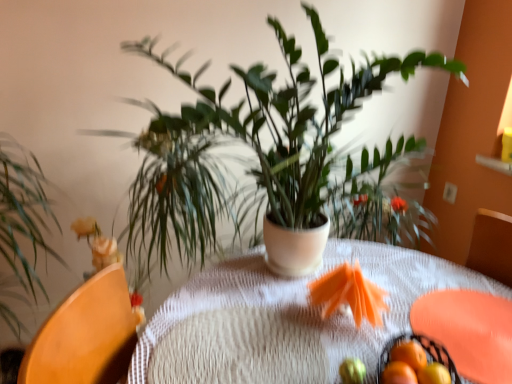
Measure the distance between point (438, 365) and camera.

A distance of 87.30 centimeters exists between point (438, 365) and camera.

Image resolution: width=512 pixels, height=384 pixels. What do you see at coordinates (434, 374) in the screenshot? I see `orange matte tangerine at lower right, the second tangerine in the front-to-back sequence` at bounding box center [434, 374].

Where is `orange matte tangerine at lower right, arranged as the third tangerine when viewed from the front`? orange matte tangerine at lower right, arranged as the third tangerine when viewed from the front is located at coordinates (409, 354).

Describe the element at coordinates (270, 159) in the screenshot. I see `green matte plant at center, which is the first houseplant in right-to-left order` at that location.

Locate an element on the screen. The height and width of the screenshot is (384, 512). orange matte tangerine at lower right, the second tangerine in the front-to-back sequence is located at coordinates (434, 374).

Is orange matte tangerine at lower right, positioned as the 1th tangerine in back-to-front order, far from orange matte tangerine at lower right, which is the 2th tangerine from back to front?

orange matte tangerine at lower right, positioned as the 1th tangerine in back-to-front order, is near orange matte tangerine at lower right, which is the 2th tangerine from back to front, not far away.

Is orange matte tangerine at lower right, positioned as the 1th tangerine in back-to-front order, at the right side of orange matte tangerine at lower right, the second tangerine in the front-to-back sequence?

In fact, orange matte tangerine at lower right, positioned as the 1th tangerine in back-to-front order, is to the left of orange matte tangerine at lower right, the second tangerine in the front-to-back sequence.

Can you tell me how much orange matte tangerine at lower right, positioned as the 1th tangerine in back-to-front order, and orange matte tangerine at lower right, which is the 2th tangerine from back to front, differ in facing direction?

The angular difference between orange matte tangerine at lower right, positioned as the 1th tangerine in back-to-front order, and orange matte tangerine at lower right, which is the 2th tangerine from back to front, is 0.000167 degrees.

Which is more to the right, orange matte tangerine at lower right, the third tangerine positioned from the back, or orange matte tangerine at lower right, the second tangerine in the front-to-back sequence?

orange matte tangerine at lower right, the second tangerine in the front-to-back sequence.

From a real-world perspective, is orange matte tangerine at lower right, the third tangerine positioned from the back, above or below orange matte tangerine at lower right, which is the 2th tangerine from back to front?

From a real-world perspective, orange matte tangerine at lower right, the third tangerine positioned from the back, is physically above orange matte tangerine at lower right, which is the 2th tangerine from back to front.

Consider the image. From the image's perspective, which one is positioned higher, orange matte tangerine at lower right, the third tangerine positioned from the back, or orange matte tangerine at lower right, which is the 2th tangerine from back to front?

orange matte tangerine at lower right, the third tangerine positioned from the back.

From their relative heights in the image, would you say smooth yellow fruit at center is taller or shorter than orange matte tangerine at lower right, the 1th tangerine viewed from the front?

smooth yellow fruit at center is shorter than orange matte tangerine at lower right, the 1th tangerine viewed from the front.

Can you confirm if smooth yellow fruit at center is bigger than orange matte tangerine at lower right, the 1th tangerine viewed from the front?

Incorrect, smooth yellow fruit at center is not larger than orange matte tangerine at lower right, the 1th tangerine viewed from the front.

From a real-world perspective, relative to orange matte tangerine at lower right, the third tangerine positioned from the back, is smooth yellow fruit at center vertically above or below?

From a real-world perspective, smooth yellow fruit at center is physically below orange matte tangerine at lower right, the third tangerine positioned from the back.

Is smooth yellow fruit at center facing away from orange matte tangerine at lower right, the third tangerine positioned from the back?

smooth yellow fruit at center is not turned away from orange matte tangerine at lower right, the third tangerine positioned from the back.

Consider the image. Between green leafy plant at left, acting as the first houseplant starting from the left, and orange matte tangerine at lower right, positioned as the 1th tangerine in back-to-front order, which one appears on the left side from the viewer's perspective?

green leafy plant at left, acting as the first houseplant starting from the left.

Is green leafy plant at left, the 2th houseplant positioned from the right, touching orange matte tangerine at lower right, arranged as the third tangerine when viewed from the front?

No, green leafy plant at left, the 2th houseplant positioned from the right, is not in contact with orange matte tangerine at lower right, arranged as the third tangerine when viewed from the front.

This screenshot has height=384, width=512. What are the coordinates of `the 2nd tangerine counting from the right side of the green leafy plant at left, acting as the first houseplant starting from the left` in the screenshot? It's located at (409, 354).

Is green leafy plant at left, acting as the first houseplant starting from the left, turned away from orange matte tangerine at lower right, arranged as the third tangerine when viewed from the front?

No, green leafy plant at left, acting as the first houseplant starting from the left, is not facing the opposite direction of orange matte tangerine at lower right, arranged as the third tangerine when viewed from the front.

Can we say orange matte tangerine at lower right, which is the 2th tangerine from back to front, lies outside green matte plant at center, which is the first houseplant in right-to-left order?

Indeed, orange matte tangerine at lower right, which is the 2th tangerine from back to front, is completely outside green matte plant at center, which is the first houseplant in right-to-left order.

Is orange matte tangerine at lower right, the second tangerine in the front-to-back sequence, facing towards green matte plant at center, which is counted as the second houseplant, starting from the left?

No, orange matte tangerine at lower right, the second tangerine in the front-to-back sequence, is not facing towards green matte plant at center, which is counted as the second houseplant, starting from the left.

Considering the sizes of objects orange matte tangerine at lower right, which is the 2th tangerine from back to front, and green matte plant at center, which is counted as the second houseplant, starting from the left, in the image provided, who is smaller, orange matte tangerine at lower right, which is the 2th tangerine from back to front, or green matte plant at center, which is counted as the second houseplant, starting from the left,?

Smaller between the two is orange matte tangerine at lower right, which is the 2th tangerine from back to front.

From the picture: Is orange matte tangerine at lower right, positioned as the 1th tangerine in back-to-front order, wider or thinner than green leafy plant at left, the 2th houseplant positioned from the right?

Clearly, orange matte tangerine at lower right, positioned as the 1th tangerine in back-to-front order, has less width compared to green leafy plant at left, the 2th houseplant positioned from the right.

From the image's perspective, between orange matte tangerine at lower right, positioned as the 1th tangerine in back-to-front order, and green leafy plant at left, acting as the first houseplant starting from the left, which one is located above?

green leafy plant at left, acting as the first houseplant starting from the left, appears higher in the image.

Are orange matte tangerine at lower right, arranged as the third tangerine when viewed from the front, and green leafy plant at left, acting as the first houseplant starting from the left, located far from each other?

orange matte tangerine at lower right, arranged as the third tangerine when viewed from the front, is far away from green leafy plant at left, acting as the first houseplant starting from the left.

From the picture: Would you consider green matte plant at center, which is counted as the second houseplant, starting from the left, to be distant from orange matte tangerine at lower right, which is the 2th tangerine from back to front?

They are positioned close to each other.

Is green matte plant at center, which is counted as the second houseplant, starting from the left, not within orange matte tangerine at lower right, the second tangerine in the front-to-back sequence?

Yes, green matte plant at center, which is counted as the second houseplant, starting from the left, is not within orange matte tangerine at lower right, the second tangerine in the front-to-back sequence.

How much distance is there between green matte plant at center, which is the first houseplant in right-to-left order, and orange matte tangerine at lower right, which is the 2th tangerine from back to front?

green matte plant at center, which is the first houseplant in right-to-left order, is 37.11 inches from orange matte tangerine at lower right, which is the 2th tangerine from back to front.

Between green matte plant at center, which is counted as the second houseplant, starting from the left, and orange matte tangerine at lower right, the second tangerine in the front-to-back sequence, which one has less height?

orange matte tangerine at lower right, the second tangerine in the front-to-back sequence.

The height and width of the screenshot is (384, 512). What are the coordinates of `tangerine below the orange matte tangerine at lower right, arranged as the third tangerine when viewed from the front (from a real-world perspective)` in the screenshot? It's located at (434, 374).

You are a GUI agent. You are given a task and a screenshot of the screen. Output one action in this format:
    pyautogui.click(x=<x>, y=<y>)
    Task: Click on the 2nd tangerine to the right of the orange matte tangerine at lower right, the 1th tangerine viewed from the front, counting from the anchor's position
    The width and height of the screenshot is (512, 384).
    Given the screenshot: What is the action you would take?
    (x=434, y=374)

Based on their spatial positions, is smooth yellow fruit at center or green leafy plant at left, the 2th houseplant positioned from the right, closer to green matte plant at center, which is counted as the second houseplant, starting from the left?

green leafy plant at left, the 2th houseplant positioned from the right, is closer to green matte plant at center, which is counted as the second houseplant, starting from the left.

Looking at this image, when comparing their distances from orange matte tangerine at lower right, positioned as the 1th tangerine in back-to-front order, does green leafy plant at left, acting as the first houseplant starting from the left, or orange matte tangerine at lower right, the third tangerine positioned from the back, seem further?

Based on the image, green leafy plant at left, acting as the first houseplant starting from the left, appears to be further to orange matte tangerine at lower right, positioned as the 1th tangerine in back-to-front order.

Based on their spatial positions, is orange matte tangerine at lower right, the 1th tangerine viewed from the front, or orange matte tangerine at lower right, the second tangerine in the front-to-back sequence, closer to green leafy plant at left, the 2th houseplant positioned from the right?

orange matte tangerine at lower right, the 1th tangerine viewed from the front, is closer to green leafy plant at left, the 2th houseplant positioned from the right.

Which object lies nearer to the anchor point orange matte tangerine at lower right, the 1th tangerine viewed from the front, orange matte tangerine at lower right, arranged as the third tangerine when viewed from the front, or orange matte tangerine at lower right, which is the 2th tangerine from back to front?

orange matte tangerine at lower right, which is the 2th tangerine from back to front, is closer to orange matte tangerine at lower right, the 1th tangerine viewed from the front.

When comparing their distances from orange matte tangerine at lower right, the 1th tangerine viewed from the front, does black wire basket at lower right or green leafy plant at left, the 2th houseplant positioned from the right, seem further?

green leafy plant at left, the 2th houseplant positioned from the right, is further to orange matte tangerine at lower right, the 1th tangerine viewed from the front.

Looking at the image, which one is located further to black wire basket at lower right, orange matte tangerine at lower right, arranged as the third tangerine when viewed from the front, or orange matte tangerine at lower right, the second tangerine in the front-to-back sequence?

The object further to black wire basket at lower right is orange matte tangerine at lower right, the second tangerine in the front-to-back sequence.

From the image, which object appears to be nearer to green leafy plant at left, acting as the first houseplant starting from the left, green matte plant at center, which is counted as the second houseplant, starting from the left, or black wire basket at lower right?

green matte plant at center, which is counted as the second houseplant, starting from the left, is closer to green leafy plant at left, acting as the first houseplant starting from the left.

From the image, which object appears to be nearer to orange matte tangerine at lower right, the 1th tangerine viewed from the front, orange matte tangerine at lower right, which is the 2th tangerine from back to front, or green leafy plant at left, the 2th houseplant positioned from the right?

The object closer to orange matte tangerine at lower right, the 1th tangerine viewed from the front, is orange matte tangerine at lower right, which is the 2th tangerine from back to front.

Find the location of a particular element. tangerine that lies between green matte plant at center, which is the first houseplant in right-to-left order, and smooth yellow fruit at center from top to bottom is located at coordinates (409, 354).

Locate an element on the screen. This screenshot has width=512, height=384. orange located between green leafy plant at left, the 2th houseplant positioned from the right, and orange matte tangerine at lower right, positioned as the 1th tangerine in back-to-front order, in the left-right direction is located at coordinates (352, 371).

Locate an element on the screen. orange between green leafy plant at left, the 2th houseplant positioned from the right, and black wire basket at lower right is located at coordinates (352, 371).

I want to click on tangerine positioned between orange matte tangerine at lower right, the third tangerine positioned from the back, and orange matte tangerine at lower right, arranged as the third tangerine when viewed from the front, from near to far, so click(x=434, y=374).